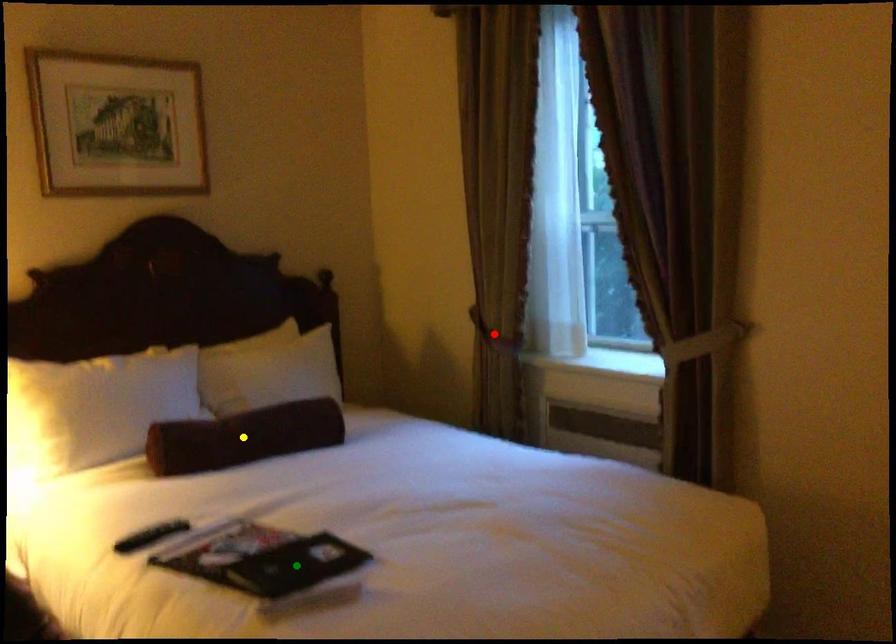
Order these from nearest to farthest:
red point
yellow point
green point

green point
yellow point
red point